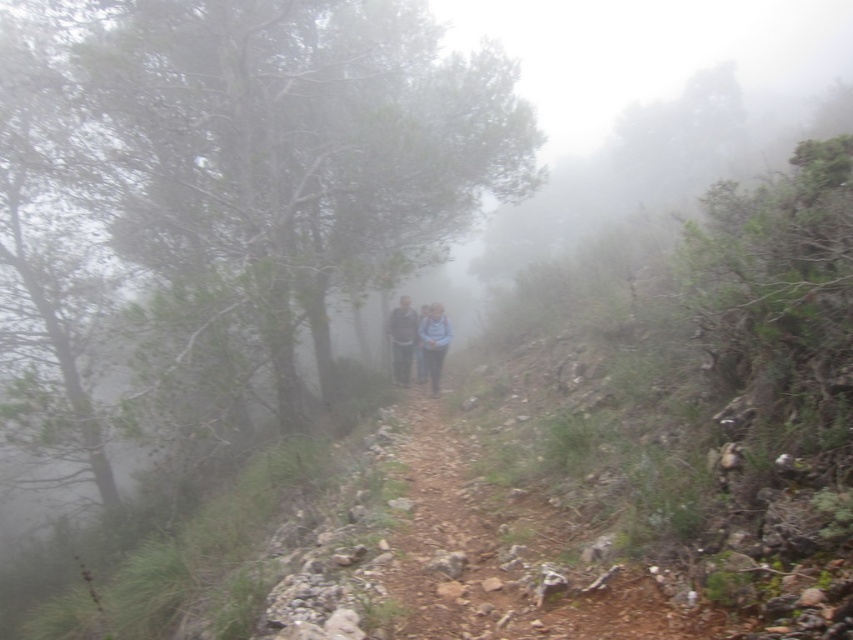
Question: Is blue fabric jacket at center to the right of dark gray sweater at center from the viewer's perspective?

Choices:
 (A) yes
 (B) no

Answer: (A)

Question: Estimate the real-world distances between objects in this image. Which object is closer to the dark gray sweater at center?

Choices:
 (A) light blue fabric at center
 (B) blue fabric jacket at center

Answer: (A)

Question: Does light blue fabric at center come behind dark gray sweater at center?

Choices:
 (A) no
 (B) yes

Answer: (A)

Question: Does blue fabric jacket at center appear over dark gray sweater at center?

Choices:
 (A) yes
 (B) no

Answer: (B)

Question: Which point is closer to the camera taking this photo?

Choices:
 (A) (408, 328)
 (B) (430, 312)
 (C) (421, 324)

Answer: (C)

Question: Which of these objects is positioned closest to the dark gray sweater at center?

Choices:
 (A) blue fabric jacket at center
 (B) light blue fabric at center

Answer: (B)